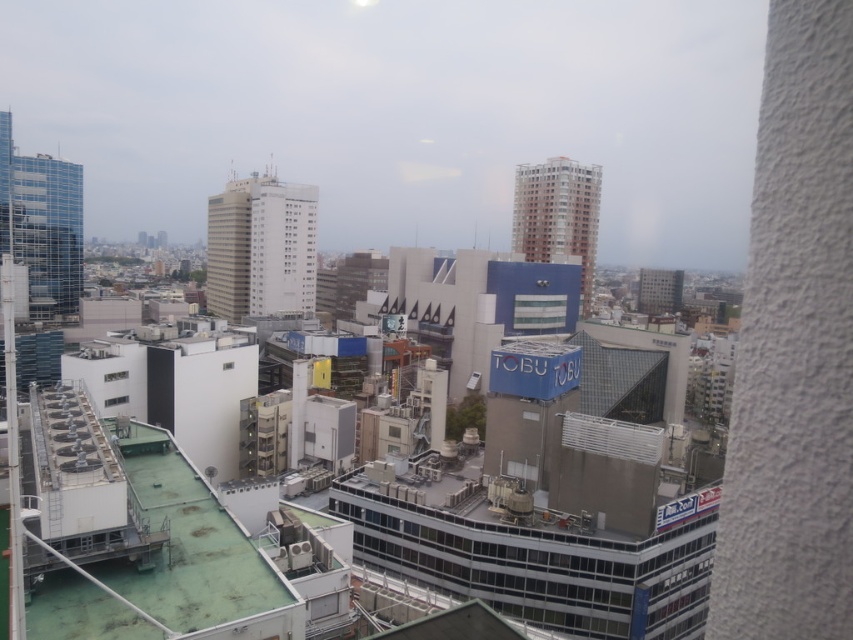
You are an architect evaluating the building facade. You notice the white plastic window at lower left and the transparent glass window at center. Which window has a larger surface area?

The transparent glass window at center has a larger surface area since the white plastic window at lower left is smaller in size compared to it.

You are standing on a rooftop and want to throw a ball from the white plastic window at lower left to the large blue sign with the word TOBU. If the ball travels in a straight line, will it hit the textured light colored wall on the right side?

The white plastic window at lower left and the large blue sign with the word TOBU are 121.62 meters apart. Since the ball travels in a straight line, it would not hit the textured light colored wall on the right side as the distance is too far for the ball to curve around the wall.

You are standing on a rooftop and want to determine which of the two points, point (103, 403) or point (120, 378), is closer to you. Based on the cityscape described, which point is nearer?

Point (103, 403) is closer to the viewer than point (120, 378).